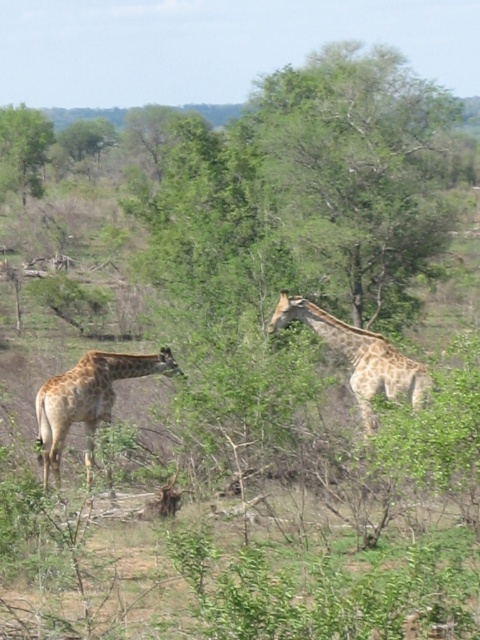
You are standing in the savanna scene with two giraffes. You see two points marked in the image. The first point is at coordinate point (x=57, y=408) and the second is at point (x=37, y=170). Which point is closer to you?

Point (x=57, y=408) is closer to the camera than point (x=37, y=170), so the first point is closer to you.

You are a wildlife photographer trying to capture a clear shot of the spotted fur giraffe at center and the green leafy tree at upper left. Given their sizes in the frame, which one will appear smaller in your photo?

The spotted fur giraffe at center occupies less space than the green leafy tree at upper left, so it will appear smaller in the photo.

You are standing in the savanna and want to reach a specific point marked as point (84, 461). If you can walk 10 feet per minute, how many minutes will it take you to reach that point?

The distance between point (84, 461) and the viewer is 47.51 feet. At a walking speed of 10 feet per minute, it would take approximately 4.75 minutes to reach the point. Since you can round to the nearest whole number, it would take about 5 minutes.